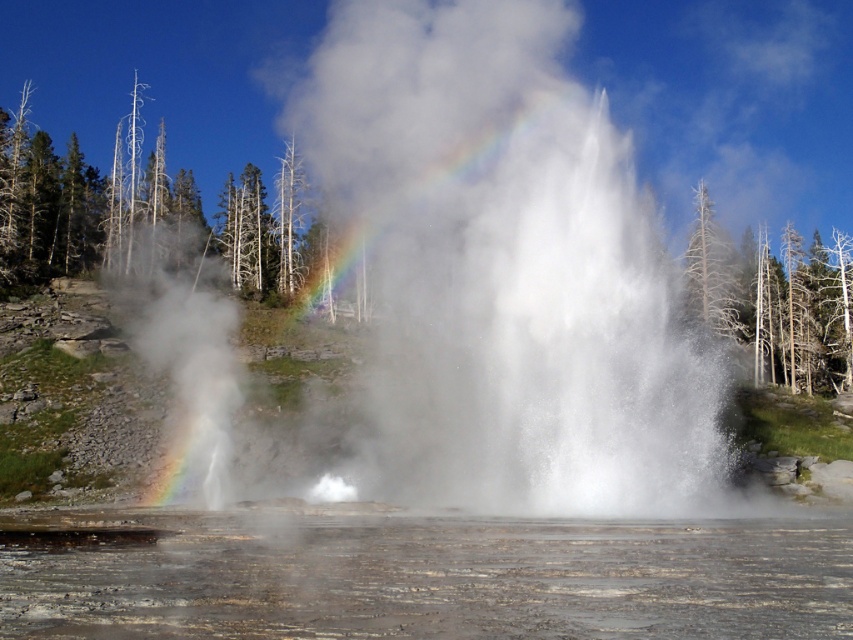
Between white vapor at center and translucent gray water at lower center, which one is positioned higher?

white vapor at center is above.

From the picture: Can you confirm if white vapor at center is positioned above translucent gray water at lower center?

Yes.

Which is behind, point (410, 129) or point (59, 602)?

The point (410, 129) is more distant.

Locate an element on the screen. The image size is (853, 640). white vapor at center is located at coordinates (477, 289).